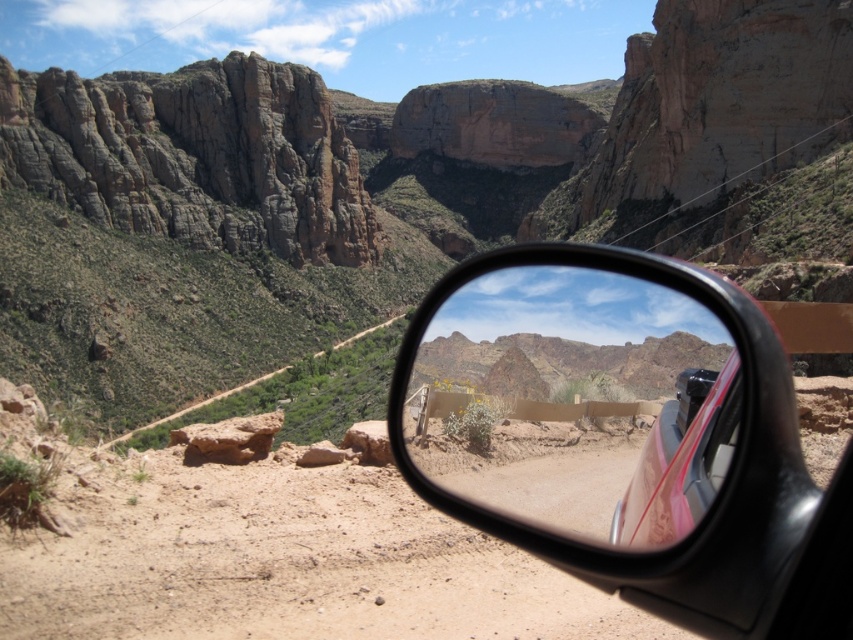
You are driving a car and looking at the rearview mirror. You see the brown sandy dirt track at lower center and the clear glass window at center. Which object appears taller in the reflection?

The brown sandy dirt track at lower center appears taller than the clear glass window at center in the rearview mirror reflection.

You are navigating a vehicle through a rugged canyon with steep cliffs and sparse vegetation. Your GPS indicates the safest path is along the brown sandy dirt track at lower center. To ensure you stay on course, where should you position your vehicle relative to the track?

The brown sandy dirt track at lower center is located at coordinates point (281, 563), so you should position your vehicle near that point to stay on course.

You are a passenger in the car and want to check the road behind you. Which object, the metallic car side mirror at center or the clear glass window at center, would allow you to see the rearview more effectively?

The metallic car side mirror at center is much taller than the clear glass window at center, so it would provide a better view of the road behind you.